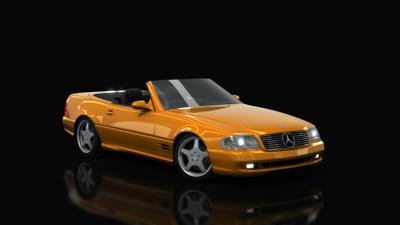
At what (x,y) coordinates should I click in order to perform the action: click on hood. Please return your answer as a coordinate pair (x, y). The image size is (400, 225). Looking at the image, I should click on (260, 119).